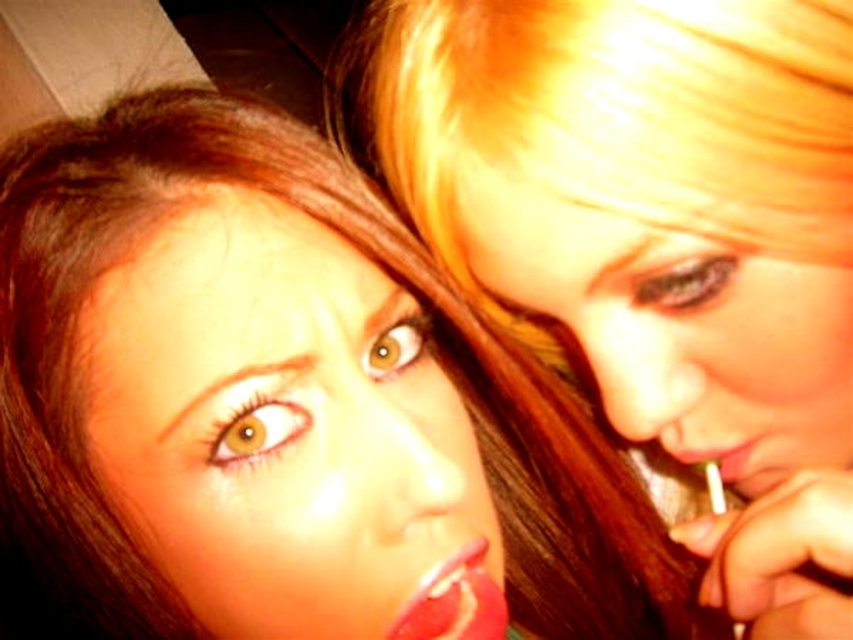
Question: From the image, what is the correct spatial relationship of shiny red lipstick at center in relation to shiny red lipstick at lower right?

Choices:
 (A) left
 (B) right

Answer: (B)

Question: Is smooth skin face at upper right positioned before smooth glossy lips at center?

Choices:
 (A) no
 (B) yes

Answer: (B)

Question: Does smooth skin face at upper right appear on the left side of shiny red lipstick at center?

Choices:
 (A) no
 (B) yes

Answer: (B)

Question: Which point is farther from the camera taking this photo?

Choices:
 (A) (621, 316)
 (B) (727, 460)
 (C) (469, 625)

Answer: (B)

Question: Which point is farther to the camera?

Choices:
 (A) (746, 432)
 (B) (134, 109)

Answer: (B)

Question: Which object is the closest to the smooth glossy lips at center?

Choices:
 (A) shiny red lipstick at center
 (B) shiny red lipstick at lower right

Answer: (A)